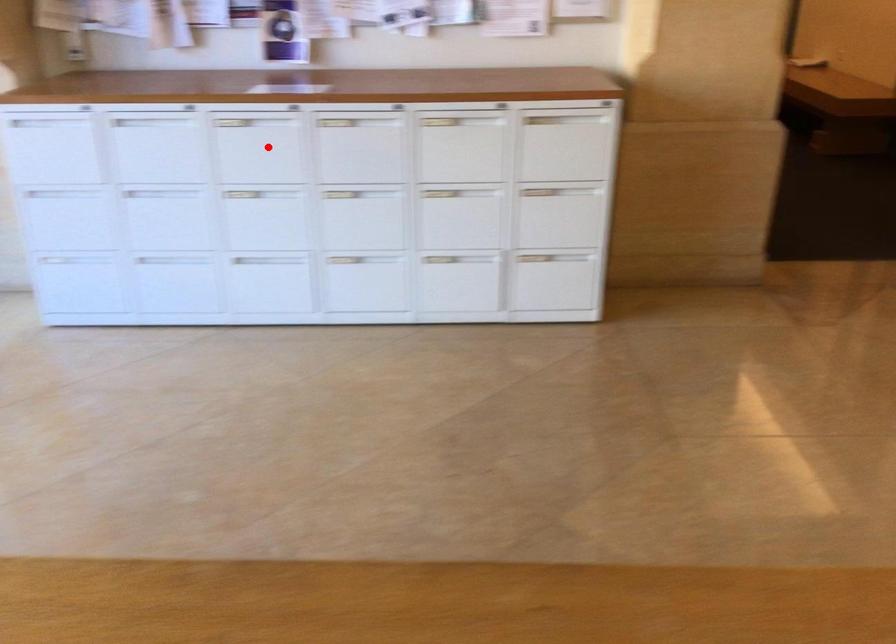
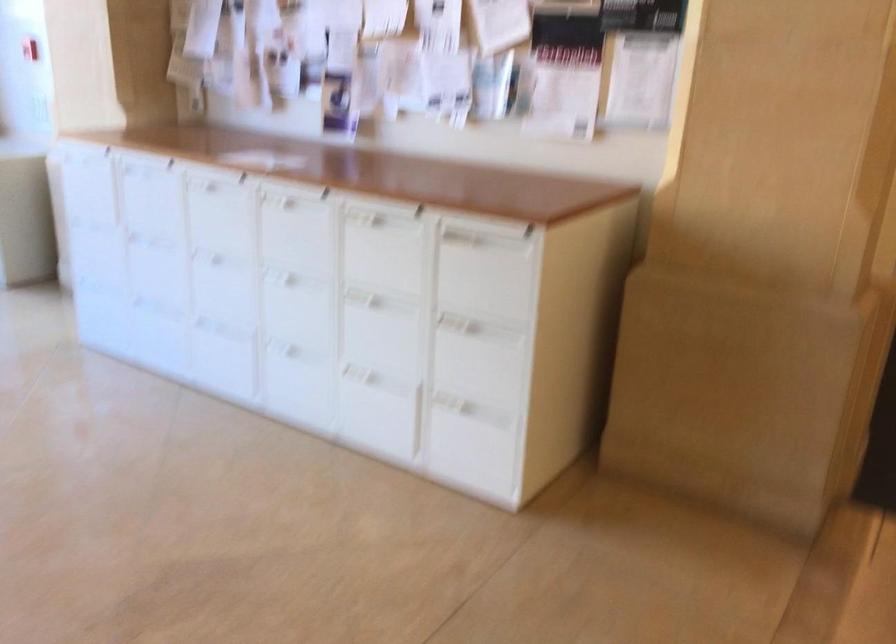
Find the pixel in the second image that matches the highlighted location in the first image.

(220, 214)